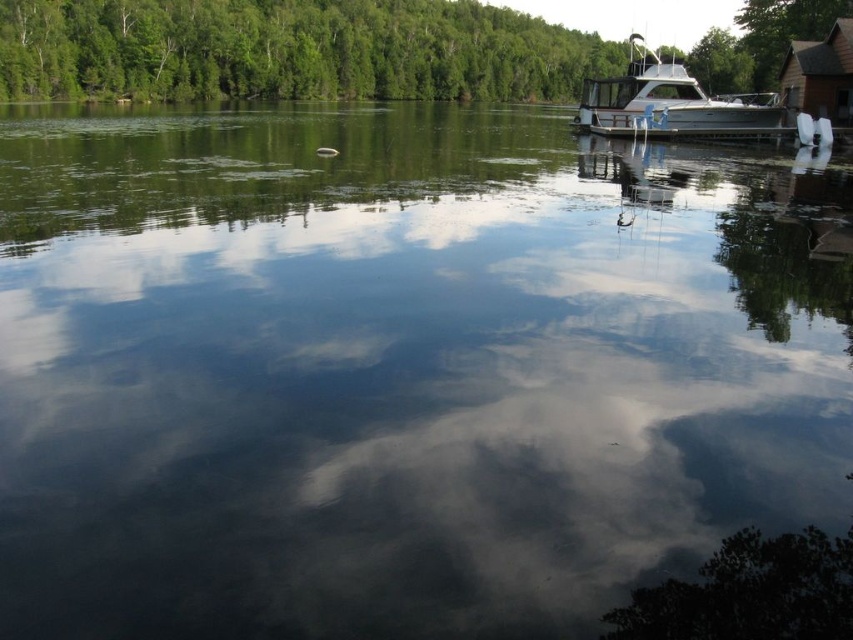
Does green leafy tree at upper center appear on the right side of brown wooden cabin at upper right?

Incorrect, green leafy tree at upper center is not on the right side of brown wooden cabin at upper right.

Describe the element at coordinates (291, 51) in the screenshot. I see `green leafy tree at upper center` at that location.

Between point (206, 22) and point (838, 92), which one is positioned behind?

The point (206, 22) is more distant.

Identify the location of green leafy tree at upper center. Image resolution: width=853 pixels, height=640 pixels. (291, 51).

Is point (322, 29) less distant than point (654, 97)?

That is False.

Does green leafy tree at upper center appear over silver metallic boat at upper right?

Yes.

Between point (490, 65) and point (744, 125), which one is positioned behind?

The point (490, 65) is behind.

Locate an element on the screen. green leafy tree at upper center is located at coordinates (291, 51).

Which is in front, point (751, 124) or point (846, 49)?

Point (846, 49) is in front.

Locate an element on the screen. Image resolution: width=853 pixels, height=640 pixels. silver metallic boat at upper right is located at coordinates click(670, 104).